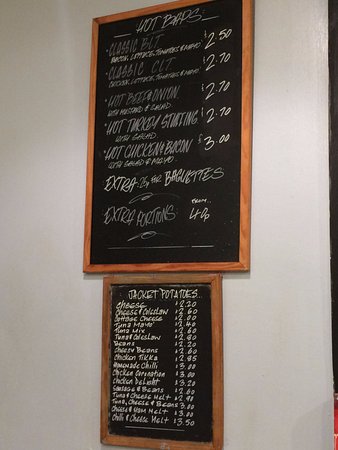
At what (x,y) coordinates should I click in order to perform the action: click on whtie wall. Please return your answer as a coordinate pair (x, y). Looking at the image, I should click on (288, 143).